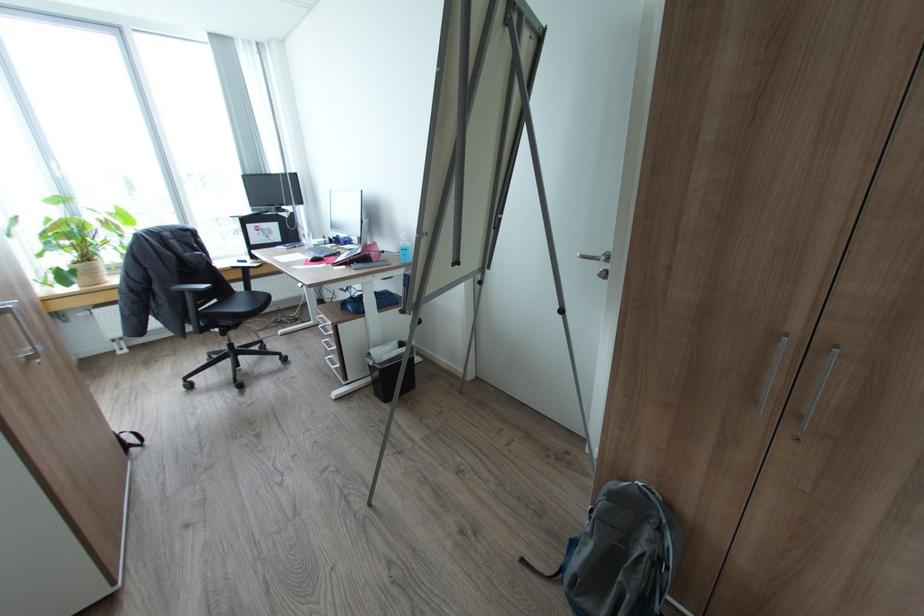
What do you see at coordinates (599, 262) in the screenshot?
I see `the silver door handle` at bounding box center [599, 262].